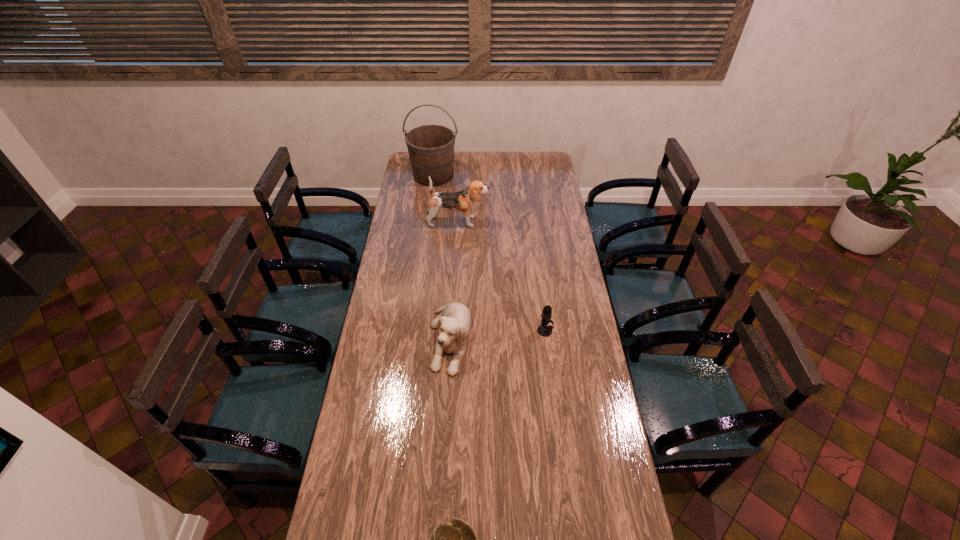
Where is `the tallest object`? The width and height of the screenshot is (960, 540). the tallest object is located at coordinates (431, 147).

The image size is (960, 540). I want to click on the farthest object, so click(431, 147).

The image size is (960, 540). In order to click on the taller puppy in this screenshot , I will do `click(463, 200)`.

Find the location of a particular element. The image size is (960, 540). the farther puppy is located at coordinates [x=463, y=200].

Find the location of a particular element. The image size is (960, 540). the third shortest object is located at coordinates (454, 322).

You are a GUI agent. You are given a task and a screenshot of the screen. Output one action in this format:
    pyautogui.click(x=<x>, y=<y>)
    Task: Click on the nearer puppy
    
    Given the screenshot: What is the action you would take?
    pyautogui.click(x=454, y=322)

Identify the location of the rightmost object. The height and width of the screenshot is (540, 960). (544, 330).

Image resolution: width=960 pixels, height=540 pixels. I want to click on the second shortest object, so click(544, 330).

Where is `vacant space positioned 0.090m on the front of the bucket`? vacant space positioned 0.090m on the front of the bucket is located at coordinates (431, 199).

This screenshot has width=960, height=540. Find the location of `vacant space located 0.280m at the face of the farther puppy`. vacant space located 0.280m at the face of the farther puppy is located at coordinates [x=543, y=222].